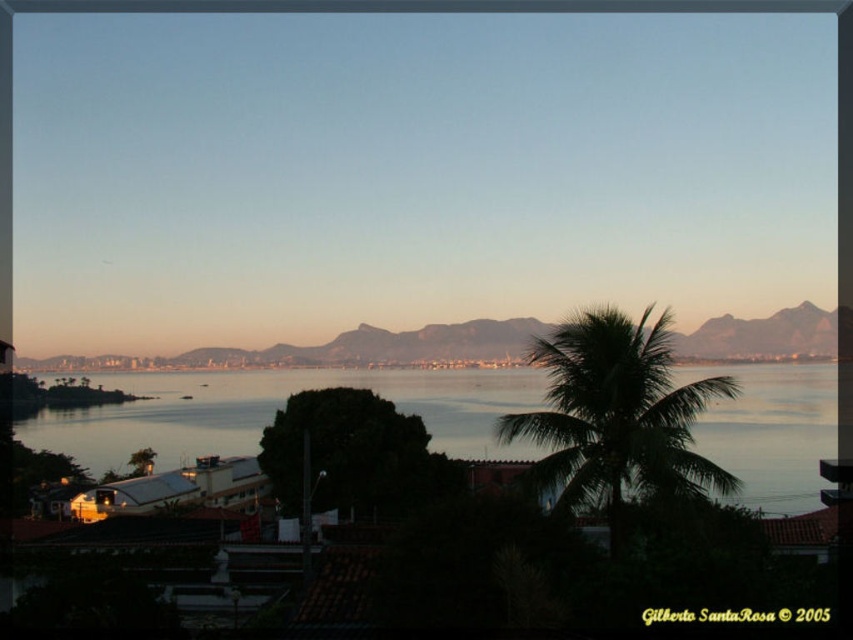
You are an airplane pilot preparing for takeoff and you see the blue sky at upper center and the rocky brown mountain at center in your view. Which object is positioned to the left when looking at them from your cockpit?

The blue sky at upper center is to the left of the rocky brown mountain at center, so the blue sky at upper center is positioned to the left.

You are a drone operator tasked with flying a drone from the green leafy palm tree at center to the rocky brown mountain at center. The drone has a maximum flight range of 1000 feet. Based on the scene, can the drone reach the mountain from the palm tree without running out of battery?

The distance between the green leafy palm tree at center and the rocky brown mountain at center is 881.39 feet, which is within the drone operator drone has a maximum flight range of 1000 feet. Therefore, the drone can successfully reach the rocky brown mountain at center from the green leafy palm tree at center without depleting its battery.